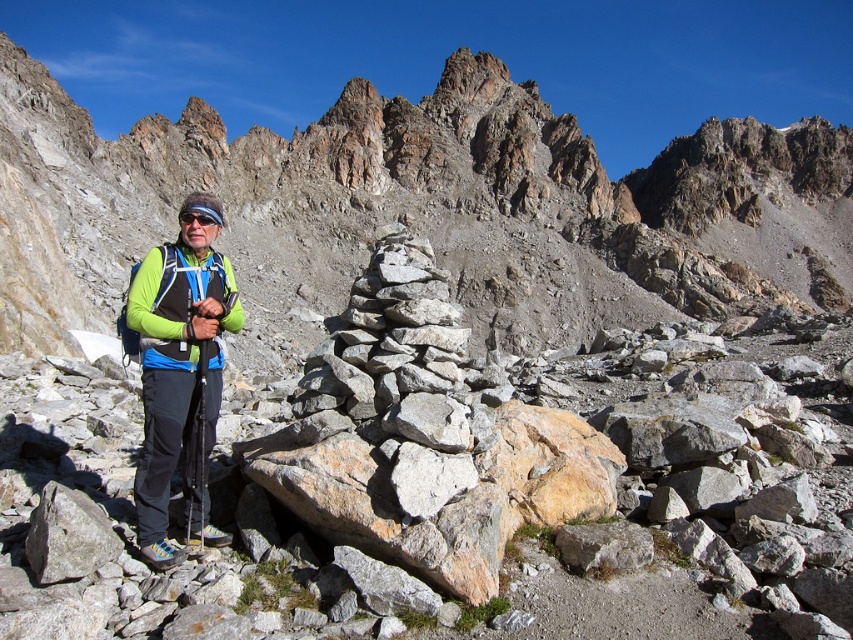
Looking at this image, you are a hiker planning to carry both the green matte jacket at left and the black matte goggles at center in your backpack. Which item will take up more space in your backpack?

The green matte jacket at left has a larger size compared to the black matte goggles at center, so it will take up more space in your backpack.

You are a hiker planning to take a photo of the green matte jacket at center and the black matte goggles at center. Which object should you focus on first to ensure both are in sharp focus?

You should focus on the green matte jacket at center first because it is closer to the viewer than the black matte goggles at center, so adjusting focus from near to far will help both be in sharp focus.